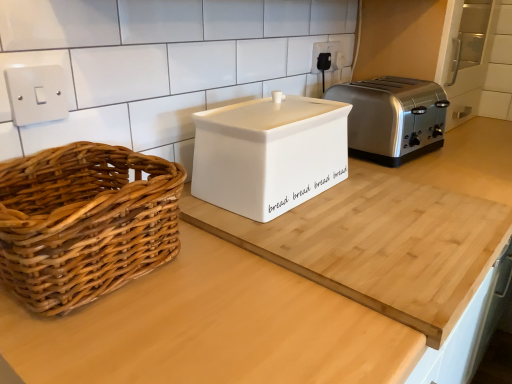
Find the location of a particular element. The width and height of the screenshot is (512, 384). free space to the right of satin silver toaster at right is located at coordinates (474, 148).